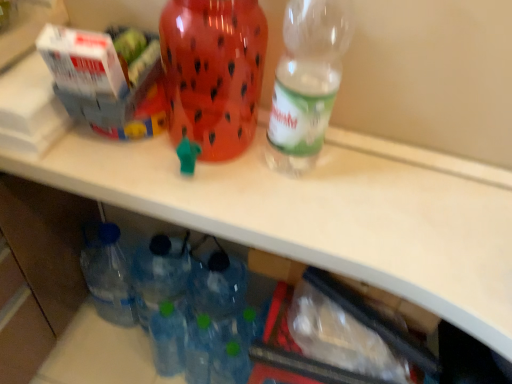
Question: Is clear plastic bottle at upper right, positioned as the 1th bottle in right-to-left order, taller than translucent plastic water jug at center, which is counted as the 1th bottle, starting from the left?

Choices:
 (A) no
 (B) yes

Answer: (B)

Question: Considering the relative sizes of clear plastic bottle at upper right, positioned as the 1th bottle in right-to-left order, and translucent plastic water jug at center, which is counted as the 1th bottle, starting from the left, in the image provided, is clear plastic bottle at upper right, positioned as the 1th bottle in right-to-left order, shorter than translucent plastic water jug at center, which is counted as the 1th bottle, starting from the left,?

Choices:
 (A) yes
 (B) no

Answer: (B)

Question: Can you see clear plastic bottle at upper right, which is counted as the 2th bottle, starting from the left, touching translucent plastic water jug at center, which is counted as the 1th bottle, starting from the left?

Choices:
 (A) no
 (B) yes

Answer: (A)

Question: From the image's perspective, is clear plastic bottle at upper right, positioned as the 1th bottle in right-to-left order, on top of translucent plastic water jug at center, the second bottle when ordered from right to left?

Choices:
 (A) no
 (B) yes

Answer: (A)

Question: Is clear plastic bottle at upper right, which is counted as the 2th bottle, starting from the left, at the right side of translucent plastic water jug at center, the second bottle when ordered from right to left?

Choices:
 (A) no
 (B) yes

Answer: (B)

Question: Considering the relative sizes of clear plastic bottle at upper right, which is counted as the 2th bottle, starting from the left, and translucent plastic water jug at center, the second bottle when ordered from right to left, in the image provided, is clear plastic bottle at upper right, which is counted as the 2th bottle, starting from the left, smaller than translucent plastic water jug at center, the second bottle when ordered from right to left,?

Choices:
 (A) yes
 (B) no

Answer: (A)

Question: From the image's perspective, does clear plastic bottle at upper right, positioned as the 1th bottle in right-to-left order, appear higher than white cardboard box at upper left, which is the first box from right to left?

Choices:
 (A) yes
 (B) no

Answer: (B)

Question: From the image's perspective, is clear plastic bottle at upper right, which is counted as the 2th bottle, starting from the left, beneath white cardboard box at upper left, which is the first box from right to left?

Choices:
 (A) no
 (B) yes

Answer: (B)

Question: Is clear plastic bottle at upper right, which is counted as the 2th bottle, starting from the left, not near white cardboard box at upper left, which is the first box from right to left?

Choices:
 (A) no
 (B) yes

Answer: (A)

Question: Does clear plastic bottle at upper right, positioned as the 1th bottle in right-to-left order, touch white cardboard box at upper left, which is the first box from right to left?

Choices:
 (A) yes
 (B) no

Answer: (B)

Question: Does clear plastic bottle at upper right, which is counted as the 2th bottle, starting from the left, turn towards white cardboard box at upper left, which is the first box from right to left?

Choices:
 (A) no
 (B) yes

Answer: (A)

Question: Does clear plastic bottle at upper right, positioned as the 1th bottle in right-to-left order, have a smaller size compared to white cardboard box at upper left, which is the first box from right to left?

Choices:
 (A) yes
 (B) no

Answer: (B)

Question: From the image's perspective, would you say white cardboard box at upper left, which appears as the second box when viewed from the left, is positioned over white cardboard box at upper left, the second box viewed from the right?

Choices:
 (A) yes
 (B) no

Answer: (B)